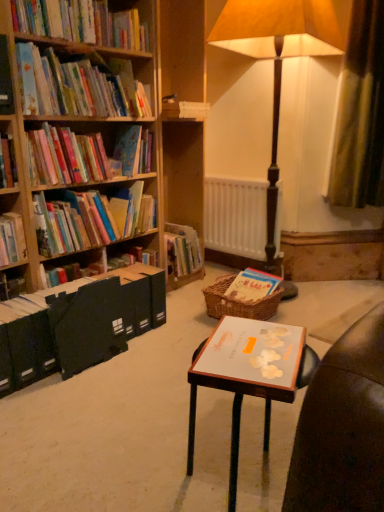
Question: From the image's perspective, relative to matte paper book at left, the third book when ordered from bottom to top, is black matte file at left, which is counted as the first paperback book, starting from the left, above or below?

Choices:
 (A) above
 (B) below

Answer: (B)

Question: In the image, is black matte file at left, the second paperback book when ordered from right to left, positioned in front of or behind matte paper book at left, the third book when ordered from bottom to top?

Choices:
 (A) behind
 (B) front

Answer: (B)

Question: Considering the real-world distances, which object is closest to the white matte radiator at center?

Choices:
 (A) brown woven picnic basket at center
 (B) white matte book at center, which appears as the second paperback book when viewed from the back
 (C) matte paper book at left, the third book when ordered from bottom to top
 (D) black matte file at left, which is counted as the first paperback book, starting from the left
 (E) wooden floor lamp at center

Answer: (E)

Question: Estimate the real-world distances between objects in this image. Which object is closer to the matte wooden bookshelf at left, which appears as the second book when ordered from the bottom?

Choices:
 (A) white matte book at center, the 1th paperback book from the front
 (B) matte cardboard basket at center, marked as the fifth book in a top-to-bottom arrangement
 (C) wooden floor lamp at center
 (D) black matte file at left, marked as the second paperback book in a front-to-back arrangement
 (E) matte paper book at left, the third book when ordered from bottom to top

Answer: (E)